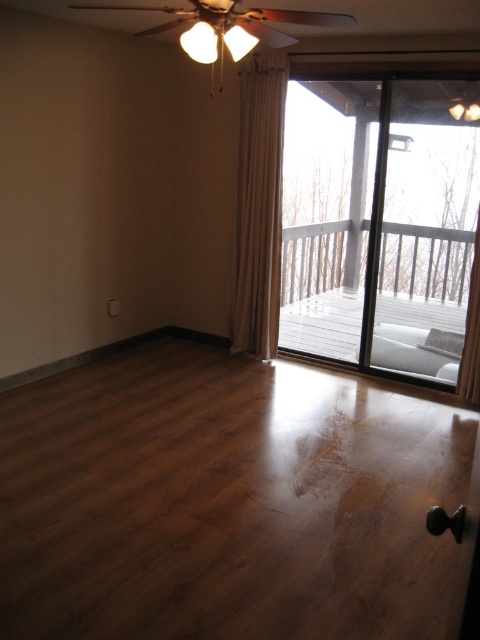
You want to move a 30 inch wide sofa through the space between the transparent glass door at center and the beige fabric curtain at center. Can you fit it through the space?

The space between the transparent glass door at center and the beige fabric curtain at center is only 27.56 inches, which is narrower than the 30 inch wide sofa. Therefore, the sofa cannot fit through this space.